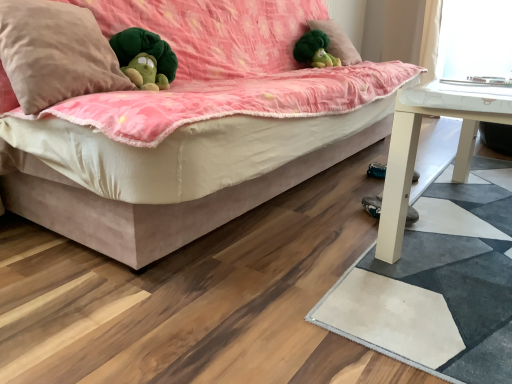
Question: Is suede-like beige studio couch at center positioned in front of beige soft pillow at upper left, the 1th pillow when ordered from left to right?

Choices:
 (A) yes
 (B) no

Answer: (A)

Question: Is suede-like beige studio couch at center smaller than beige soft pillow at upper left, the first pillow positioned from the bottom?

Choices:
 (A) yes
 (B) no

Answer: (B)

Question: Can we say suede-like beige studio couch at center lies outside beige soft pillow at upper left, the 1th pillow when ordered from left to right?

Choices:
 (A) no
 (B) yes

Answer: (B)

Question: From a real-world perspective, is suede-like beige studio couch at center on top of beige soft pillow at upper left, which is counted as the second pillow, starting from the right?

Choices:
 (A) no
 (B) yes

Answer: (A)

Question: Does suede-like beige studio couch at center have a greater height compared to beige soft pillow at upper left, which is counted as the second pillow, starting from the right?

Choices:
 (A) no
 (B) yes

Answer: (B)

Question: Considering the positions of green plush toy at upper center and beige soft pillow at upper left, the first pillow positioned from the bottom, in the image, is green plush toy at upper center wider or thinner than beige soft pillow at upper left, the first pillow positioned from the bottom,?

Choices:
 (A) thin
 (B) wide

Answer: (A)

Question: Considering their positions, is green plush toy at upper center located in front of or behind beige soft pillow at upper left, the 1th pillow when ordered from left to right?

Choices:
 (A) behind
 (B) front

Answer: (A)

Question: Based on their sizes in the image, would you say green plush toy at upper center is bigger or smaller than beige soft pillow at upper left, the 1th pillow when ordered from left to right?

Choices:
 (A) big
 (B) small

Answer: (B)

Question: In the image, is green plush toy at upper center on the left side or the right side of beige soft pillow at upper left, which is counted as the second pillow, starting from the right?

Choices:
 (A) right
 (B) left

Answer: (A)

Question: Considering the relative positions of suede-like beige studio couch at center and beige soft pillow at upper left, which is counted as the second pillow, starting from the right, in the image provided, is suede-like beige studio couch at center to the left or to the right of beige soft pillow at upper left, which is counted as the second pillow, starting from the right,?

Choices:
 (A) right
 (B) left

Answer: (A)

Question: Is point (50, 163) positioned closer to the camera than point (30, 8)?

Choices:
 (A) farther
 (B) closer

Answer: (A)

Question: Do you think suede-like beige studio couch at center is within beige soft pillow at upper left, the 1th pillow when ordered from left to right, or outside of it?

Choices:
 (A) outside
 (B) inside

Answer: (A)

Question: Is suede-like beige studio couch at center in front of or behind beige soft pillow at upper left, arranged as the second pillow when viewed from the back, in the image?

Choices:
 (A) behind
 (B) front

Answer: (B)

Question: From a real-world perspective, is suede-like beige studio couch at center physically located above or below green plush at upper center, the second pillow in the front-to-back sequence?

Choices:
 (A) below
 (B) above

Answer: (A)

Question: Is suede-like beige studio couch at center bigger or smaller than green plush at upper center, the first pillow positioned from the back?

Choices:
 (A) big
 (B) small

Answer: (A)